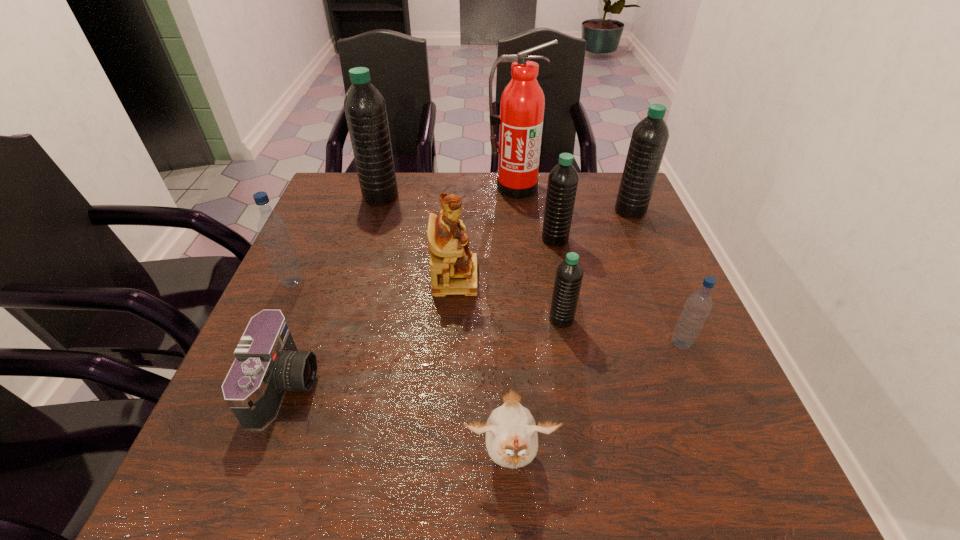
The height and width of the screenshot is (540, 960). I want to click on the smaller blue water bottle, so click(x=698, y=305).

I want to click on the nearer blue water bottle, so click(x=698, y=305).

Find the location of `the seventh farthest object`. the seventh farthest object is located at coordinates (569, 274).

The width and height of the screenshot is (960, 540). In order to click on the fifth farthest water bottle in this screenshot , I will do `click(569, 274)`.

Identify the location of bird. (511, 433).

Find the location of a particular element. The width and height of the screenshot is (960, 540). the second shortest object is located at coordinates (511, 433).

Locate an element on the screen. Image resolution: width=960 pixels, height=540 pixels. camera is located at coordinates (267, 363).

I want to click on the shortest object, so click(267, 363).

This screenshot has width=960, height=540. In order to click on vacant space located on the label side of the fire extinguisher in this screenshot , I will do `click(522, 256)`.

The width and height of the screenshot is (960, 540). In order to click on vacant region located on the left of the tallest water bottle in this screenshot , I will do `click(326, 197)`.